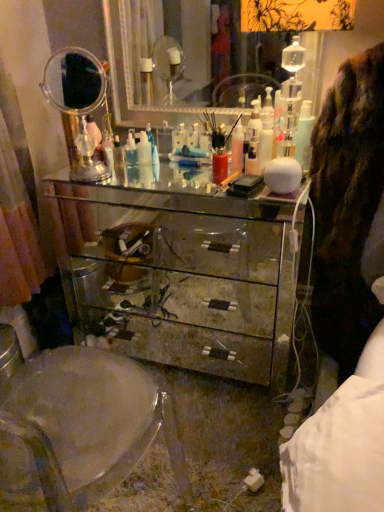
Describe the element at coordinates (157, 60) in the screenshot. This screenshot has height=512, width=384. I see `silver mirrored dresser at upper center, the 1th mirror viewed from the right` at that location.

What is the approximate height of clear glass mirror at upper left, the second mirror viewed from the right?

14.54 inches.

This screenshot has height=512, width=384. What do you see at coordinates (182, 278) in the screenshot?
I see `mirrored glass chest of drawers at center` at bounding box center [182, 278].

The image size is (384, 512). I want to click on white glossy bottle at upper right, so tap(265, 142).

Which is closer, (259, 138) or (56, 433)?

The point (56, 433) is in front.

You are a GUI agent. You are given a task and a screenshot of the screen. Output one action in this format:
    pyautogui.click(x=<x>, y=<y>)
    Task: Click on the swivel chair on the left of white glossy bottle at upper right
    The height and width of the screenshot is (512, 384).
    Given the screenshot: What is the action you would take?
    pyautogui.click(x=76, y=425)

Is white glossy bottle at upper right to the right of transparent plastic swivel chair at center from the viewer's perspective?

Indeed, white glossy bottle at upper right is positioned on the right side of transparent plastic swivel chair at center.

Which of these two, white glossy bottle at upper right or transparent plastic swivel chair at center, is smaller?

white glossy bottle at upper right.

Could white glossy bottle at upper right be considered to be inside clear glass mirror at upper left, the second mirror viewed from the right?

Definitely not — white glossy bottle at upper right is not inside clear glass mirror at upper left, the second mirror viewed from the right.

Which of these two, clear glass mirror at upper left, the second mirror viewed from the right, or white glossy bottle at upper right, is bigger?

Bigger between the two is clear glass mirror at upper left, the second mirror viewed from the right.

Is clear glass mirror at upper left, positioned as the first mirror in left-to-right order, not near white glossy bottle at upper right?

They are positioned close to each other.

Based on their positions, is clear glass mirror at upper left, positioned as the first mirror in left-to-right order, located to the left or right of white glossy bottle at upper right?

From the image, it's evident that clear glass mirror at upper left, positioned as the first mirror in left-to-right order, is to the left of white glossy bottle at upper right.

From the image's perspective, between mirrored glass chest of drawers at center and transparent plastic swivel chair at center, which one is located above?

mirrored glass chest of drawers at center is shown above in the image.

Does mirrored glass chest of drawers at center have a greater height compared to transparent plastic swivel chair at center?

No, mirrored glass chest of drawers at center is not taller than transparent plastic swivel chair at center.

Is transparent plastic swivel chair at center not inside mirrored glass chest of drawers at center?

Yes, transparent plastic swivel chair at center is outside of mirrored glass chest of drawers at center.

Would you consider transparent plastic swivel chair at center to be distant from mirrored glass chest of drawers at center?

No, transparent plastic swivel chair at center is not far away from mirrored glass chest of drawers at center.

Could you tell me if transparent plastic swivel chair at center is facing mirrored glass chest of drawers at center?

Yes, transparent plastic swivel chair at center is aimed at mirrored glass chest of drawers at center.

From the image's perspective, is transparent plastic swivel chair at center beneath mirrored glass chest of drawers at center?

Yes.

Considering the positions of objects silver mirrored dresser at upper center, which is the second mirror from left to right, and mirrored glass chest of drawers at center in the image provided, who is more to the left, silver mirrored dresser at upper center, which is the second mirror from left to right, or mirrored glass chest of drawers at center?

From the viewer's perspective, mirrored glass chest of drawers at center appears more on the left side.

From the image's perspective, does silver mirrored dresser at upper center, the 1th mirror viewed from the right, appear lower than mirrored glass chest of drawers at center?

Incorrect, from the image's perspective, silver mirrored dresser at upper center, the 1th mirror viewed from the right, is higher than mirrored glass chest of drawers at center.

From a real-world perspective, is silver mirrored dresser at upper center, the 1th mirror viewed from the right, beneath mirrored glass chest of drawers at center?

Actually, silver mirrored dresser at upper center, the 1th mirror viewed from the right, is physically above mirrored glass chest of drawers at center in the real world.

How many degrees apart are the facing directions of transparent plastic swivel chair at center and white glossy bottle at upper right?

They differ by 170 degrees in their facing directions.

In the scene shown: From a real-world perspective, is transparent plastic swivel chair at center located beneath white glossy bottle at upper right?

Yes, from a real-world perspective, transparent plastic swivel chair at center is below white glossy bottle at upper right.

Does transparent plastic swivel chair at center lie in front of white glossy bottle at upper right?

Yes, it is in front of white glossy bottle at upper right.

Is point (64, 370) positioned before point (259, 169)?

Yes, it is in front of point (259, 169).

From a real-world perspective, is mirrored glass chest of drawers at center located higher than clear glass mirror at upper left, positioned as the first mirror in left-to-right order?

No, from a real-world perspective, mirrored glass chest of drawers at center is not over clear glass mirror at upper left, positioned as the first mirror in left-to-right order

Considering the positions of objects mirrored glass chest of drawers at center and clear glass mirror at upper left, the second mirror viewed from the right, in the image provided, who is in front, mirrored glass chest of drawers at center or clear glass mirror at upper left, the second mirror viewed from the right,?

Positioned in front is mirrored glass chest of drawers at center.

Based on the photo, is mirrored glass chest of drawers at center turned away from clear glass mirror at upper left, positioned as the first mirror in left-to-right order?

No, mirrored glass chest of drawers at center is not facing away from clear glass mirror at upper left, positioned as the first mirror in left-to-right order.

From the picture: From the image's perspective, between mirrored glass chest of drawers at center and clear glass mirror at upper left, the second mirror viewed from the right, who is located below?

mirrored glass chest of drawers at center.

The height and width of the screenshot is (512, 384). I want to click on toiletry above the transparent plastic swivel chair at center (from the image's perspective), so click(265, 142).

Locate an element on the screen. toiletry located underneath the clear glass mirror at upper left, positioned as the first mirror in left-to-right order (from a real-world perspective) is located at coordinates (x=265, y=142).

When comparing their distances from silver mirrored dresser at upper center, the 1th mirror viewed from the right, does mirrored glass chest of drawers at center or transparent plastic swivel chair at center seem closer?

Based on the image, mirrored glass chest of drawers at center appears to be nearer to silver mirrored dresser at upper center, the 1th mirror viewed from the right.

Estimate the real-world distances between objects in this image. Which object is closer to mirrored glass chest of drawers at center, transparent plastic swivel chair at center or silver mirrored dresser at upper center, the 1th mirror viewed from the right?

transparent plastic swivel chair at center is closer to mirrored glass chest of drawers at center.

From the picture: Looking at the image, which one is located further to clear glass mirror at upper left, positioned as the first mirror in left-to-right order, transparent plastic swivel chair at center or silver mirrored dresser at upper center, which is the second mirror from left to right?

silver mirrored dresser at upper center, which is the second mirror from left to right, is further to clear glass mirror at upper left, positioned as the first mirror in left-to-right order.

Estimate the real-world distances between objects in this image. Which object is closer to mirrored glass chest of drawers at center, clear glass mirror at upper left, the second mirror viewed from the right, or silver mirrored dresser at upper center, the 1th mirror viewed from the right?

Among the two, clear glass mirror at upper left, the second mirror viewed from the right, is located nearer to mirrored glass chest of drawers at center.

From the image, which object appears to be farther from clear glass mirror at upper left, the second mirror viewed from the right, mirrored glass chest of drawers at center or silver mirrored dresser at upper center, the 1th mirror viewed from the right?

silver mirrored dresser at upper center, the 1th mirror viewed from the right.

Which object lies nearer to the anchor point mirrored glass chest of drawers at center, silver mirrored dresser at upper center, which is the second mirror from left to right, or clear glass mirror at upper left, the second mirror viewed from the right?

Based on the image, clear glass mirror at upper left, the second mirror viewed from the right, appears to be nearer to mirrored glass chest of drawers at center.

Based on their spatial positions, is mirrored glass chest of drawers at center or transparent plastic swivel chair at center closer to white glossy bottle at upper right?

The object closer to white glossy bottle at upper right is mirrored glass chest of drawers at center.

Based on their spatial positions, is silver mirrored dresser at upper center, the 1th mirror viewed from the right, or white glossy bottle at upper right further from clear glass mirror at upper left, positioned as the first mirror in left-to-right order?

Among the two, silver mirrored dresser at upper center, the 1th mirror viewed from the right, is located further to clear glass mirror at upper left, positioned as the first mirror in left-to-right order.

I want to click on toiletry between silver mirrored dresser at upper center, the 1th mirror viewed from the right, and transparent plastic swivel chair at center vertically, so click(265, 142).

Find the location of a particular element. chest of drawers between transparent plastic swivel chair at center and white glossy bottle at upper right along the z-axis is located at coordinates (182, 278).

Identify the location of chest of drawers between silver mirrored dresser at upper center, the 1th mirror viewed from the right, and transparent plastic swivel chair at center from top to bottom. (182, 278).

The image size is (384, 512). Find the location of `the chest of drawers situated between clear glass mirror at upper left, positioned as the first mirror in left-to-right order, and white glossy bottle at upper right from left to right`. the chest of drawers situated between clear glass mirror at upper left, positioned as the first mirror in left-to-right order, and white glossy bottle at upper right from left to right is located at coordinates (182, 278).